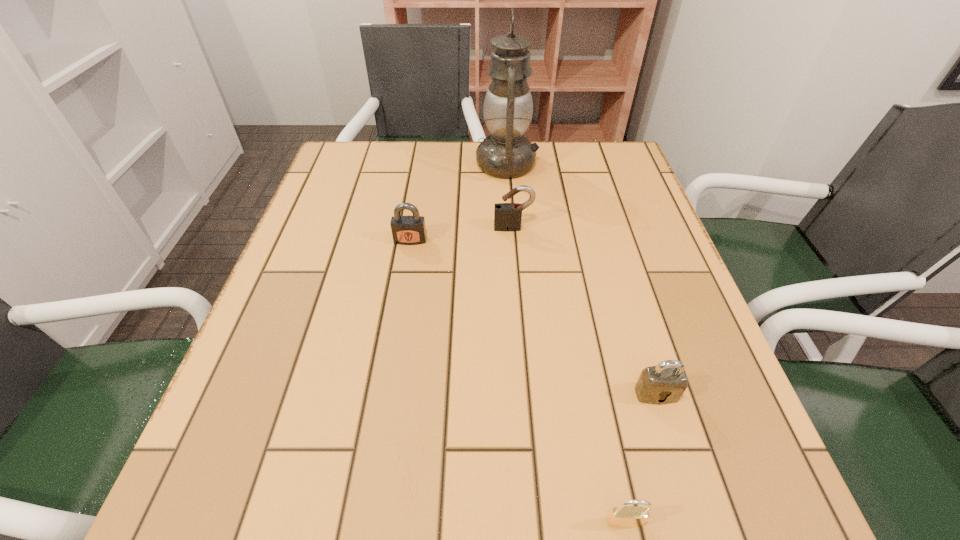
Image resolution: width=960 pixels, height=540 pixels. In order to click on oil lamp in this screenshot , I will do coord(508,106).

Find the location of a particular element. This screenshot has width=960, height=540. the farthest object is located at coordinates (508, 106).

I want to click on the third padlock from right to left, so click(507, 216).

The image size is (960, 540). Identify the location of the second farthest object. (507, 216).

Where is `the leftmost padlock`? the leftmost padlock is located at coordinates (406, 230).

Where is `the leftmost object`? The image size is (960, 540). the leftmost object is located at coordinates (406, 230).

This screenshot has width=960, height=540. Identify the location of the rightmost padlock. (665, 383).

You are a GUI agent. You are given a task and a screenshot of the screen. Output one action in this format:
    pyautogui.click(x=<x>, y=<y>)
    Task: Click on the second nearest padlock
    
    Given the screenshot: What is the action you would take?
    pyautogui.click(x=665, y=383)

The height and width of the screenshot is (540, 960). Identify the location of the nearest object. (623, 516).

The height and width of the screenshot is (540, 960). I want to click on the shortest object, so click(x=623, y=516).